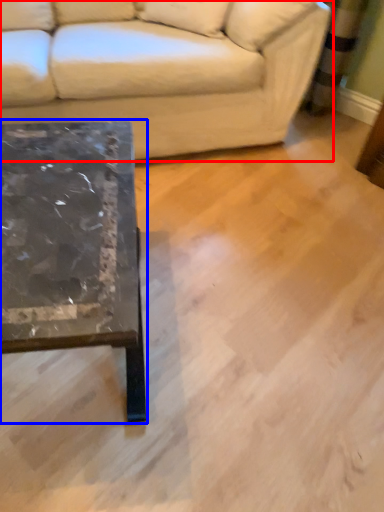
Question: Which object appears farthest to the camera in this image, studio couch (highlighted by a red box) or coffee table (highlighted by a blue box)?

Choices:
 (A) studio couch
 (B) coffee table

Answer: (A)